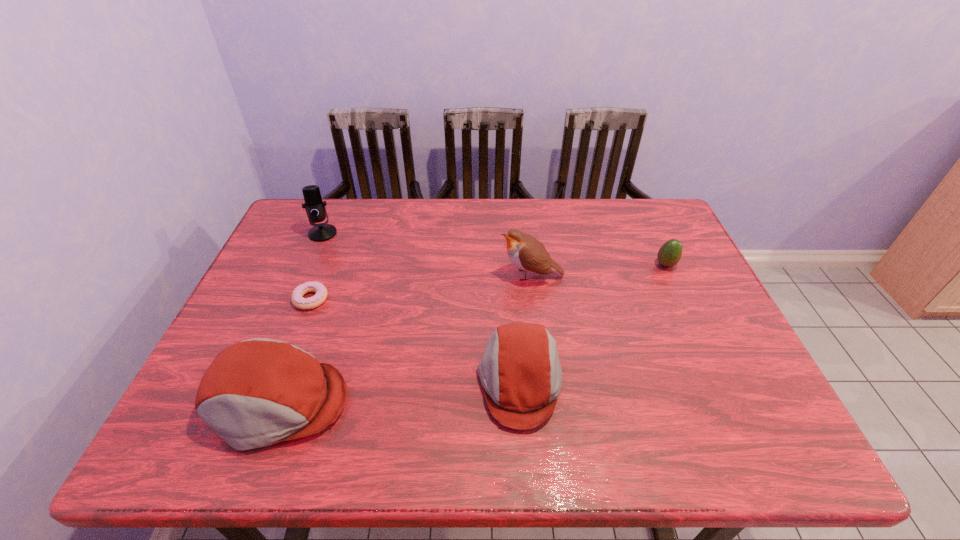
Where is `vacant region that satisfies the following two spatial constraints: 1. on the stand of the microphone; 2. on the right side of the avocado`? This screenshot has height=540, width=960. vacant region that satisfies the following two spatial constraints: 1. on the stand of the microphone; 2. on the right side of the avocado is located at coordinates (309, 265).